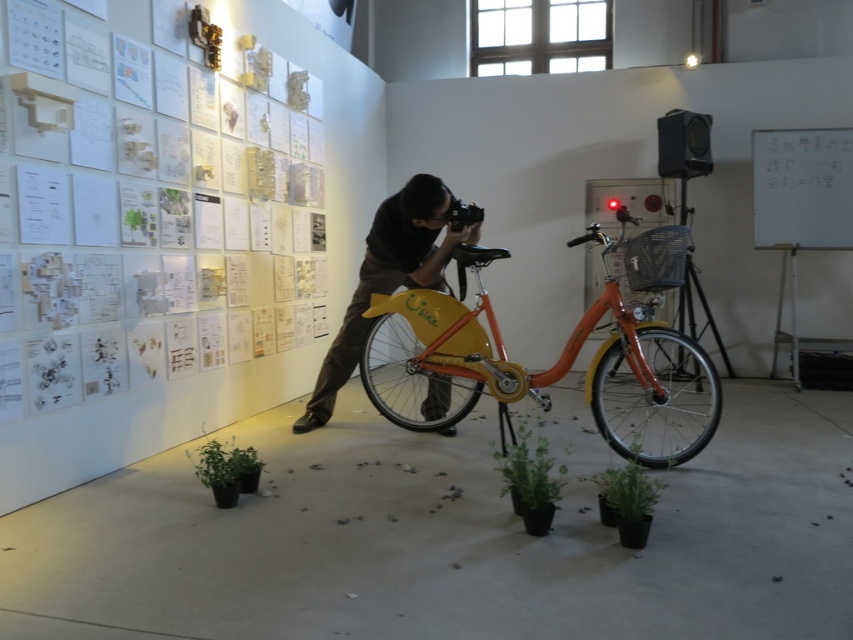
Does point (851, 177) lie behind point (544, 474)?

Yes, it is behind point (544, 474).

Which is above, whiteboard at upper right or green matte plant at center?

whiteboard at upper right is higher up.

Is point (769, 138) closer to viewer compared to point (521, 493)?

No.

The height and width of the screenshot is (640, 853). I want to click on whiteboard at upper right, so click(802, 188).

Is point (173, 352) positioned after point (433, 214)?

Yes, point (173, 352) is farther from viewer.

Consider the image. Who is positioned more to the right, white paper posters at upper left or matte black camera at center?

matte black camera at center is more to the right.

I want to click on white paper posters at upper left, so click(x=151, y=202).

In order to click on whiteboard at upper right in this screenshot , I will do click(x=802, y=188).

Is whiteboard at upper right positioned before green matte plant at lower left?

No.

Who is more forward, (822,205) or (241,460)?

Point (241,460) is in front.

Locate an element on the screen. This screenshot has height=640, width=853. whiteboard at upper right is located at coordinates (802, 188).